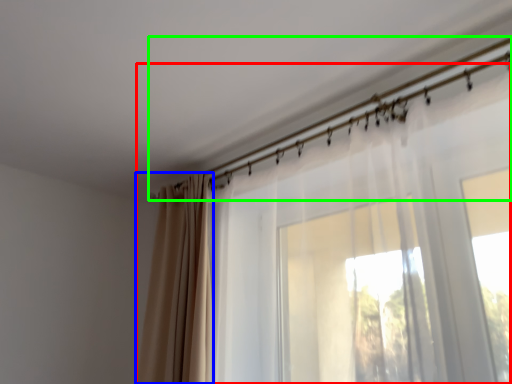
Question: Which object is positioned farthest from curtain (highlighted by a red box)? Select from curtain (highlighted by a blue box) and clothesline (highlighted by a green box).

Choices:
 (A) curtain
 (B) clothesline

Answer: (A)